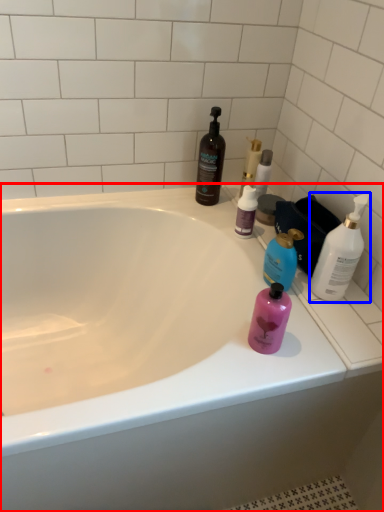
Question: Which point is further to the camera, bathtub (highlighted by a red box) or bottle (highlighted by a blue box)?

Choices:
 (A) bathtub
 (B) bottle

Answer: (B)